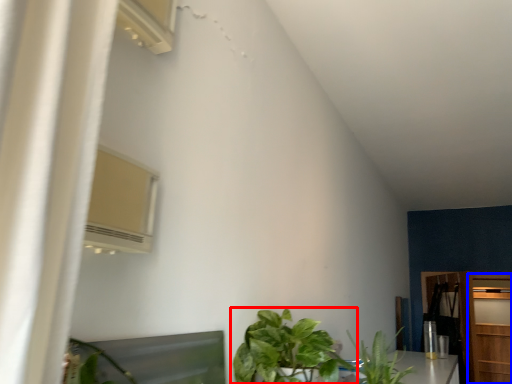
Question: Which object is closer to the camera taking this photo, houseplant (highlighted by a red box) or door (highlighted by a blue box)?

Choices:
 (A) houseplant
 (B) door

Answer: (A)